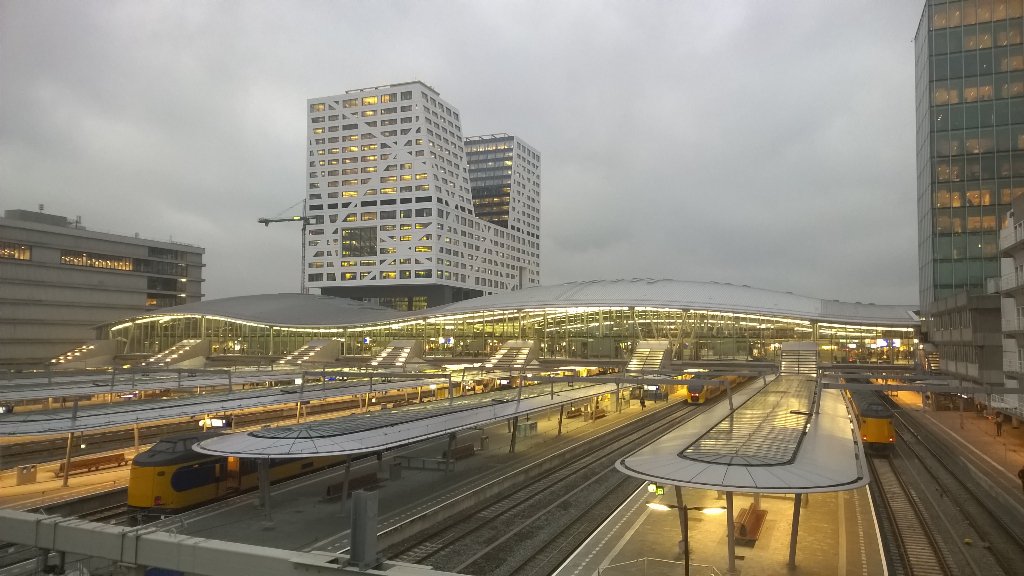
The height and width of the screenshot is (576, 1024). I want to click on stairs, so [510, 356], [651, 352], [299, 360], [159, 355], [82, 346].